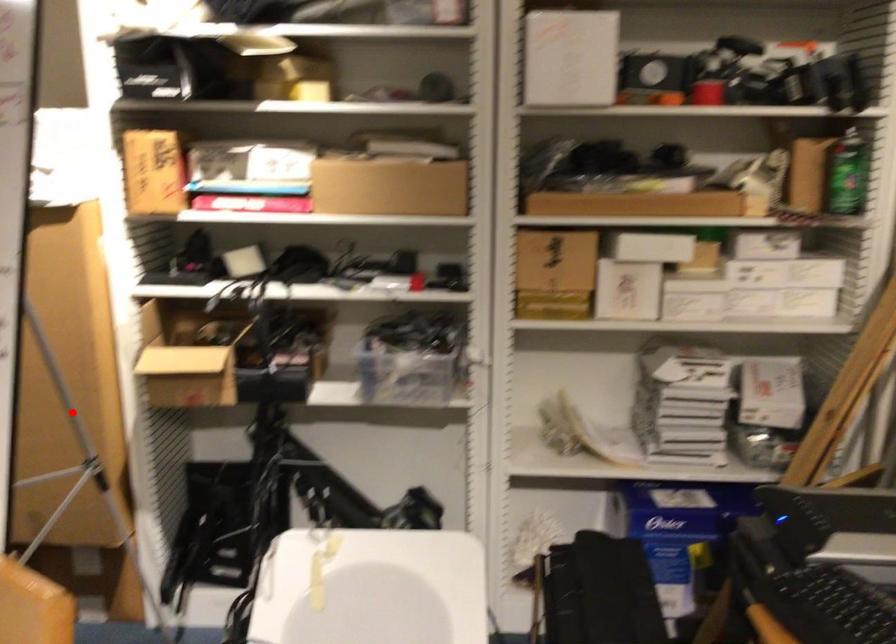
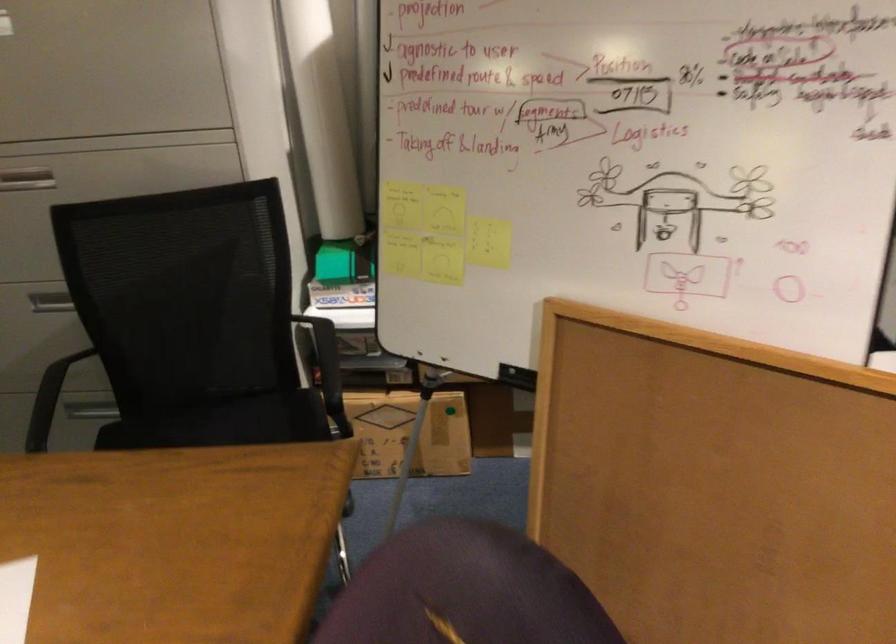
Question: I am providing you with two images of the same scene from different viewpoints. A red point is marked on the first image. Is the red point's position out of view in image 2?

Choices:
 (A) Yes
 (B) No

Answer: (A)